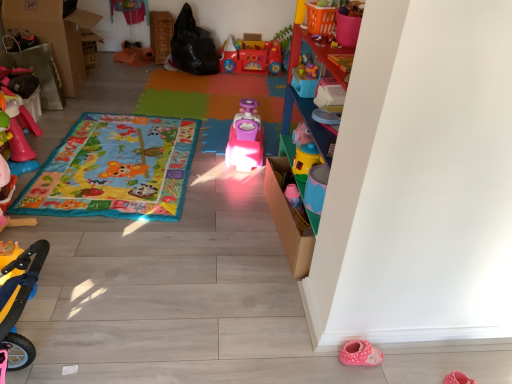
Find the location of a particular element. Image resolution: width=512 pixels, height=384 pixels. free spot behind rubberized yellow scooter at left, the seventh toy viewed from the right is located at coordinates (41, 182).